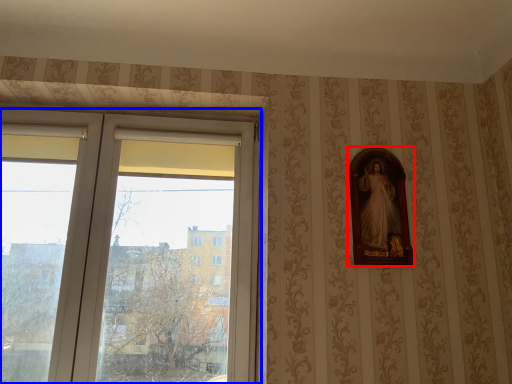
Question: Which point is further to the camera, picture frame (highlighted by a red box) or window (highlighted by a blue box)?

Choices:
 (A) picture frame
 (B) window

Answer: (A)